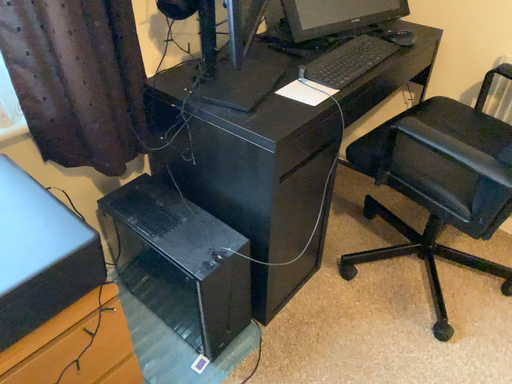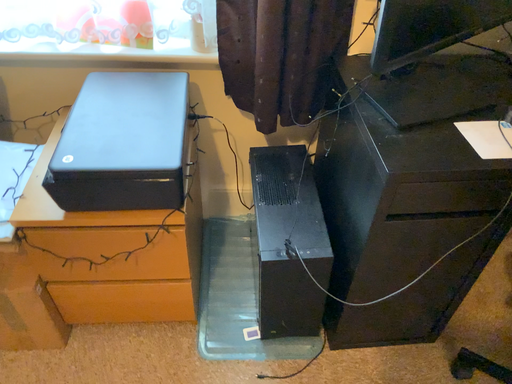
Question: Which way did the camera rotate in the video?

Choices:
 (A) rotated left
 (B) rotated right

Answer: (A)